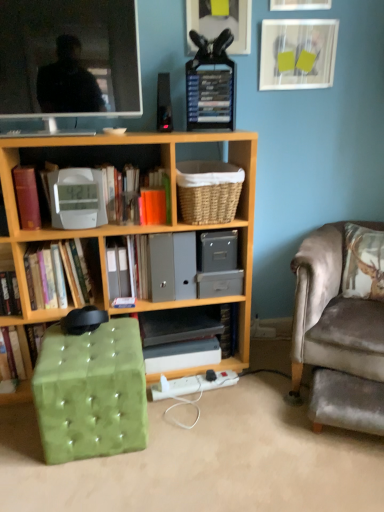
Where is `vacant space that is to the left of velvet green footrest at lower right`? The image size is (384, 512). vacant space that is to the left of velvet green footrest at lower right is located at coordinates (283, 425).